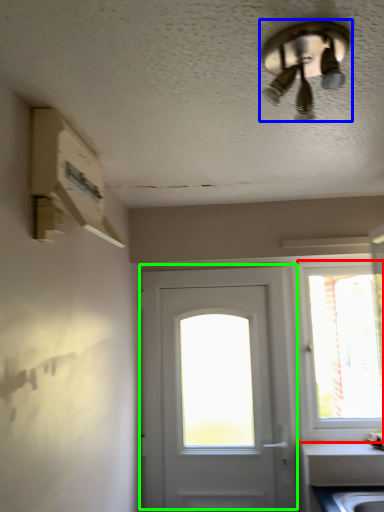
Question: Which object is positioned closest to window (highlighted by a red box)? Select from ceiling fan (highlighted by a blue box) and door (highlighted by a green box).

Choices:
 (A) ceiling fan
 (B) door

Answer: (B)